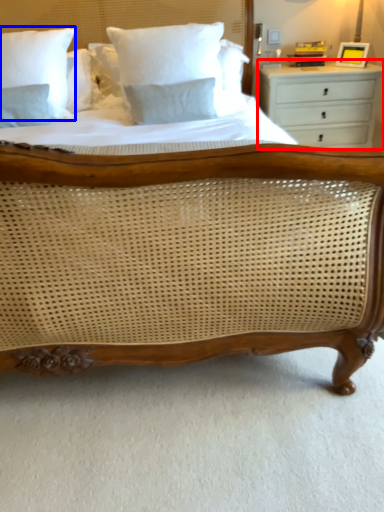
Question: Among these objects, which one is nearest to the camera, chest of drawers (highlighted by a red box) or pillow (highlighted by a blue box)?

Choices:
 (A) chest of drawers
 (B) pillow

Answer: (B)